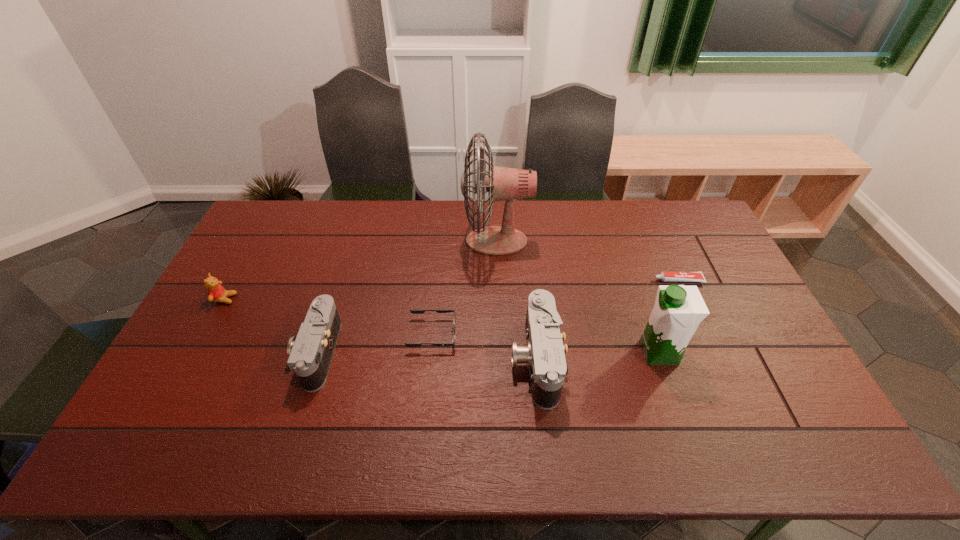
Image resolution: width=960 pixels, height=540 pixels. I want to click on vacant space located on the front-facing side of the sixth object from left to right, so click(531, 353).

Where is `object present at the far edge`? object present at the far edge is located at coordinates (502, 183).

Find the location of a particular element. object that is at the left edge is located at coordinates (216, 293).

Where is `object located in the right edge section of the desktop`? This screenshot has height=540, width=960. object located in the right edge section of the desktop is located at coordinates (664, 276).

In the image, there is a desktop. What are the coordinates of `vacant space at the far edge` in the screenshot? It's located at (376, 200).

The image size is (960, 540). In order to click on vacant space at the near edge in this screenshot , I will do `click(333, 411)`.

The image size is (960, 540). In the image, there is a desktop. Find the location of `free space at the left edge`. free space at the left edge is located at coordinates (243, 244).

Find the location of a particular element. vacant space at the right edge of the desktop is located at coordinates (765, 362).

Identify the location of vacant space at the far left corner of the desktop. (276, 204).

The image size is (960, 540). Find the location of `free space at the near left corner`. free space at the near left corner is located at coordinates (169, 390).